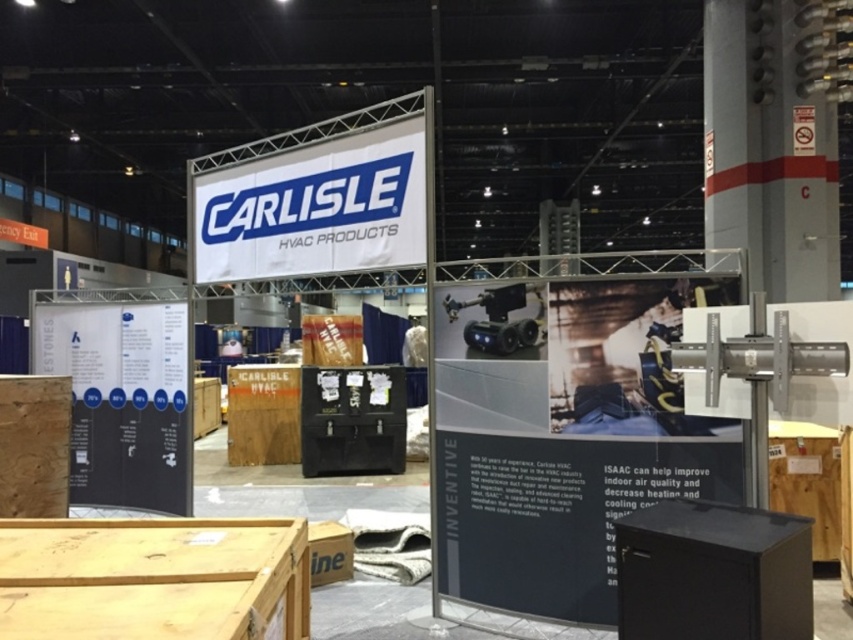
You are an architect designing a new booth for a trade show. You need to ensure that the metallic gray pole at upper right and the white fabric banner at upper center are visible from the entrance. Given their sizes, which object might require strategic placement to avoid blocking the other?

The metallic gray pole at upper right is bigger than the white fabric banner at upper center, so the metallic gray pole at upper right might need to be placed carefully to prevent it from blocking the smaller banner.

You are setting up a temporary structure for an event. You have two objects to place in the booth area. The metallic gray pole at upper right and the white fabric banner at upper center. Considering their sizes, which object should be placed at a higher position to maintain structural balance?

The metallic gray pole at upper right should be placed at a higher position since it is taller than the white fabric banner at upper center, ensuring structural balance by aligning their heights appropriately.